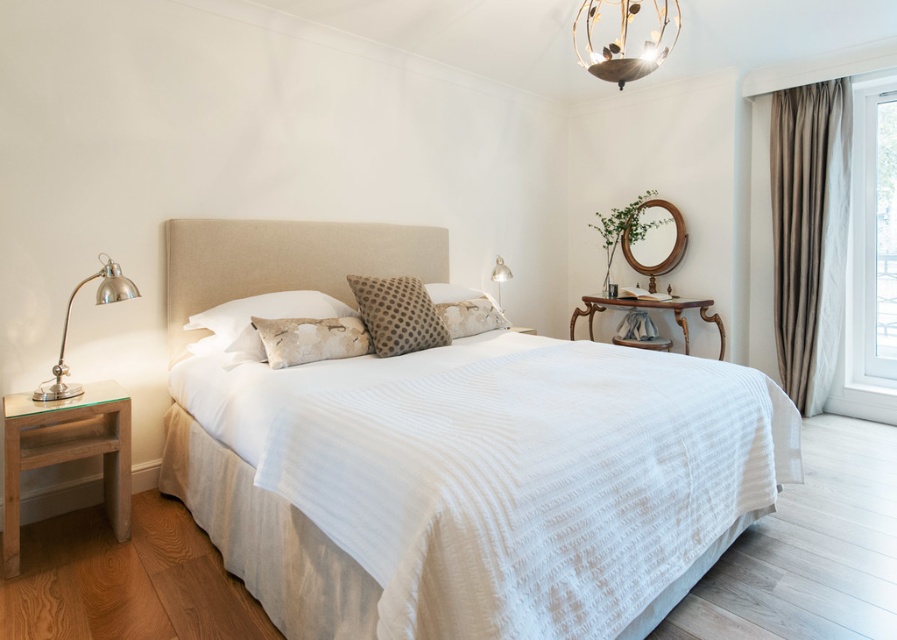
Question: Which object is the farthest from the white textured bed at center?

Choices:
 (A) white plastic window at right
 (B) transparent glass door at right
 (C) brown dotted pillow at center
 (D) textured beige pillow at center

Answer: (B)

Question: Is white textured bed at center closer to camera compared to brown velvet curtain at right?

Choices:
 (A) yes
 (B) no

Answer: (A)

Question: Among these objects, which one is nearest to the camera?

Choices:
 (A) white textured bed at center
 (B) gold metallic chandelier at upper center
 (C) brown velvet curtain at right

Answer: (A)

Question: Does white plastic window at right have a smaller size compared to metallic silver lamp at upper right?

Choices:
 (A) yes
 (B) no

Answer: (B)

Question: Can you confirm if brown velvet curtain at right is thinner than brown dotted pillow at center?

Choices:
 (A) no
 (B) yes

Answer: (B)

Question: Estimate the real-world distances between objects in this image. Which object is closer to the brown dotted pillow at center?

Choices:
 (A) gold metallic chandelier at upper center
 (B) brown velvet curtain at right

Answer: (A)